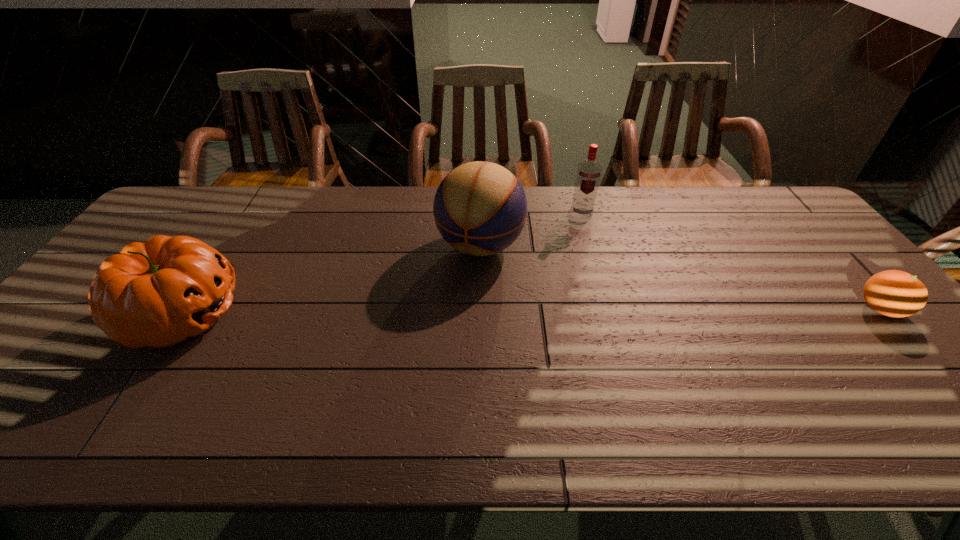
What are the coordinates of `the third tallest object` in the screenshot? It's located at pyautogui.click(x=158, y=293).

Identify the location of pumpkin. (158, 293).

Find the location of `the rightmost object`. the rightmost object is located at coordinates (893, 293).

Find the location of `the shortest object`. the shortest object is located at coordinates (893, 293).

The width and height of the screenshot is (960, 540). Identify the location of the second object from right to left. (588, 175).

Locate an element on the screen. The height and width of the screenshot is (540, 960). the farthest object is located at coordinates (588, 175).

This screenshot has width=960, height=540. Find the location of `the second object from left to right`. the second object from left to right is located at coordinates (480, 208).

Find the location of `free space located 0.100m on the carved face of the pumpkin`. free space located 0.100m on the carved face of the pumpkin is located at coordinates (279, 314).

At what (x,y) coordinates should I click in order to perform the action: click on free space located 0.080m on the back of the shortest object. Please return your answer as a coordinate pair (x, y). This screenshot has width=960, height=540. Looking at the image, I should click on (848, 273).

I want to click on blank space located 0.300m on the front label of the second object from right to left, so click(x=583, y=282).